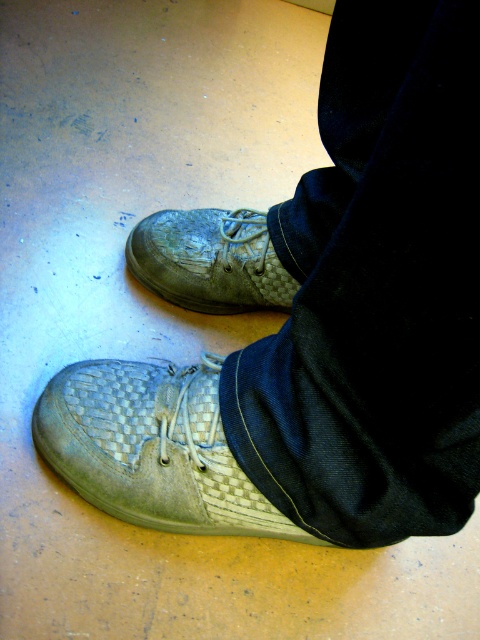
You are trying to decide which shoe to wear for a short walk. You notice the woven fabric shoe at lower center and the worn leather shoe at center. Which one is positioned to the left?

The woven fabric shoe at lower center is positioned to the left of the worn leather shoe at center.

Based on the coordinates provided, where exactly is the woven fabric shoe at lower center located in the image?

The woven fabric shoe at lower center is located at point coordinates of 0.702 in the x axis and 0.319 in the y axis.

Looking at this image, you are a shoe designer observing the image. You want to create a new shoe model that combines both the woven fabric shoe at lower center and the worn leather shoe at center. Which shoe should have the higher height in your design?

The woven fabric shoe at lower center has a greater height compared to worn leather shoe at center, so the woven fabric shoe at lower center should be the one with the higher height in the design.